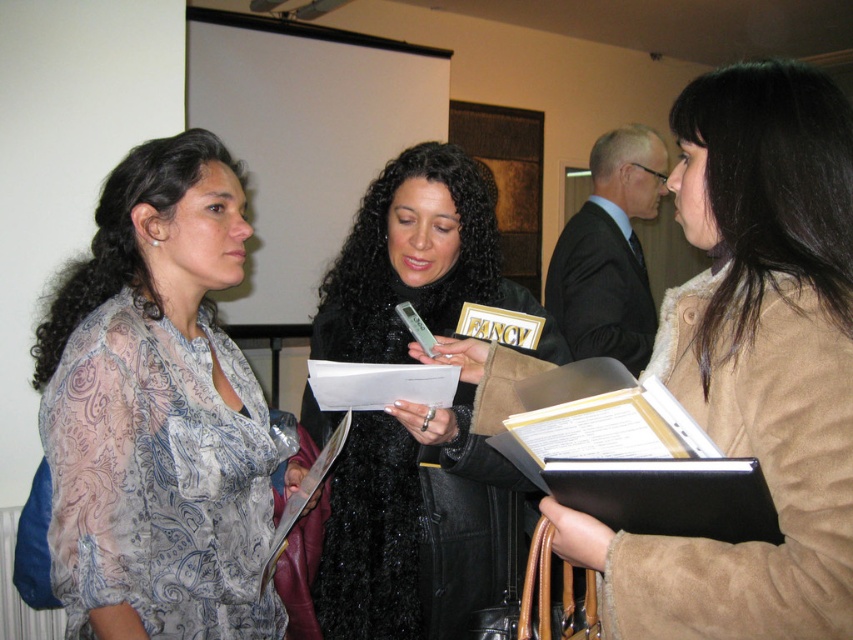
Question: Which is farther from the black fuzzy coat at center?

Choices:
 (A) translucent floral blouse at center
 (B) suede beige coat at right

Answer: (B)

Question: Is suede beige coat at right in front of translucent floral blouse at center?

Choices:
 (A) no
 (B) yes

Answer: (B)

Question: Does suede beige coat at right appear on the left side of black fuzzy coat at center?

Choices:
 (A) yes
 (B) no

Answer: (B)

Question: Which point is closer to the camera?

Choices:
 (A) suede beige coat at right
 (B) black fuzzy coat at center
 (C) translucent floral blouse at center

Answer: (A)

Question: Considering the relative positions of suede beige coat at right and black fuzzy coat at center in the image provided, where is suede beige coat at right located with respect to black fuzzy coat at center?

Choices:
 (A) above
 (B) below

Answer: (A)

Question: Which of the following is the farthest from the observer?

Choices:
 (A) suede beige coat at right
 (B) translucent floral blouse at center
 (C) black fuzzy coat at center

Answer: (C)